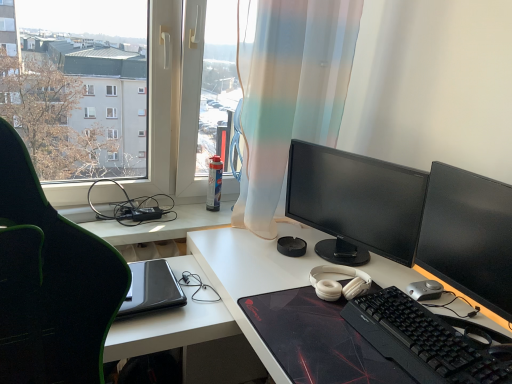
Question: Is black matte desk at center bigger or smaller than matte black monitor at center, positioned as the 2th computer monitor in front-to-back order?

Choices:
 (A) big
 (B) small

Answer: (A)

Question: Is black matte desk at center wider or thinner than matte black monitor at center, the 1th computer monitor when ordered from back to front?

Choices:
 (A) wide
 (B) thin

Answer: (A)

Question: Which is nearer to the silver metallic mouse at lower right?

Choices:
 (A) black textured mousepad at center
 (B) translucent fabric curtain at center
 (C) black matte keyboard at lower right
 (D) white matte headphones at center
 (E) black matte desk at center

Answer: (D)

Question: Which is farther from the white matte headphones at center?

Choices:
 (A) silver metallic mouse at lower right
 (B) black glossy monitor at right, the first computer monitor from the front
 (C) black textured mousepad at center
 (D) transparent plastic window at upper left
 (E) black matte desk at center

Answer: (D)